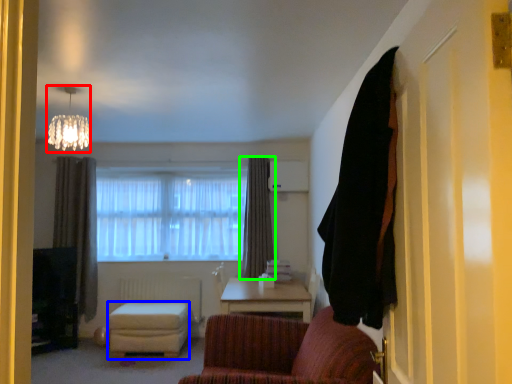
Question: Considering the real-world distances, which object is closest to lamp (highlighted by a red box)? stool (highlighted by a blue box) or curtain (highlighted by a green box).

Choices:
 (A) stool
 (B) curtain

Answer: (A)